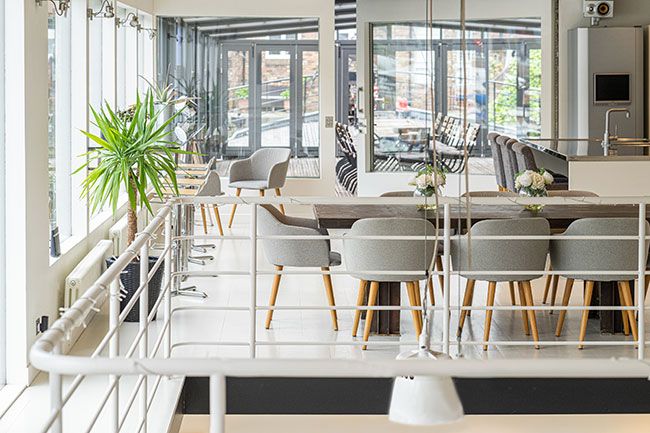
Where is `grey chairs`? Image resolution: width=650 pixels, height=433 pixels. grey chairs is located at coordinates (608, 265), (499, 238), (383, 268), (280, 247), (280, 180), (214, 194), (530, 172), (515, 160), (494, 148).